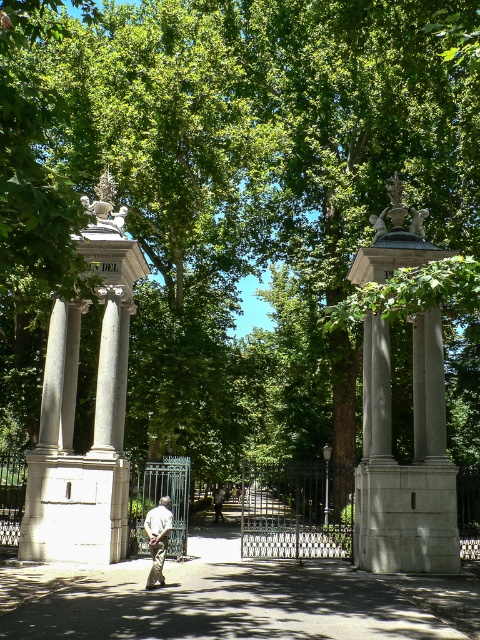
Based on the photo, you are standing at the park entrance and want to walk towards the two points marked in the image. Which point, point [158,547] or point [219,509], will you reach first?

Point [158,547] is closer to the viewer than point [219,509], so you will reach point [158,547] first.

You are standing at the park entrance and see a person wearing camouflage fabric pants at center and light brown leather jacket at center. Which clothing item is located to the right when viewed from the front?

The camouflage fabric pants at center is positioned on the right side of light brown leather jacket at center, so it is located to the right when viewed from the front.

You are a park visitor carrying a large backpack and want to place it between the gray stone column at left and the camouflage fabric pants at center. Is there enough space for the backpack?

The gray stone column at left and camouflage fabric pants at center are 8.38 feet apart from each other, so there is enough space to place the backpack between them.